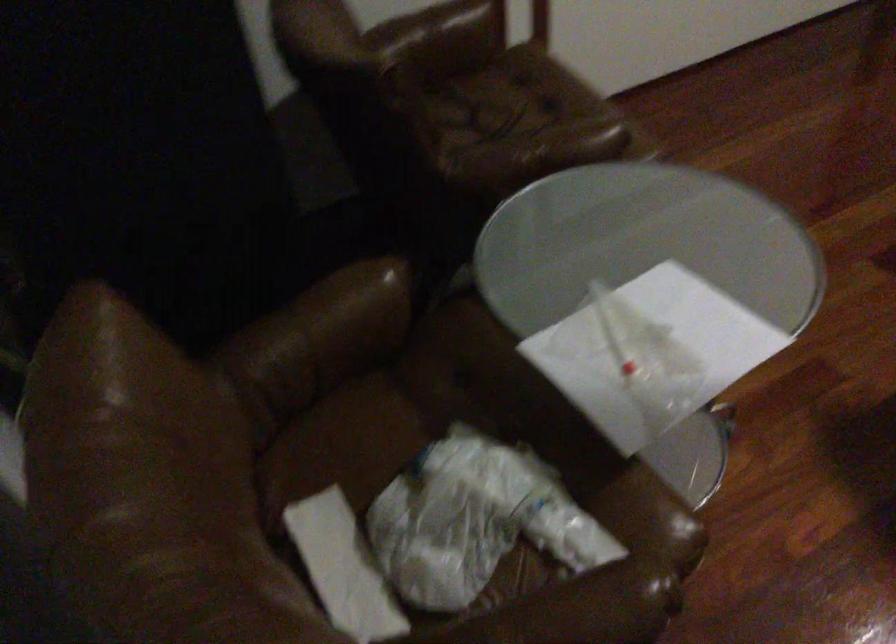
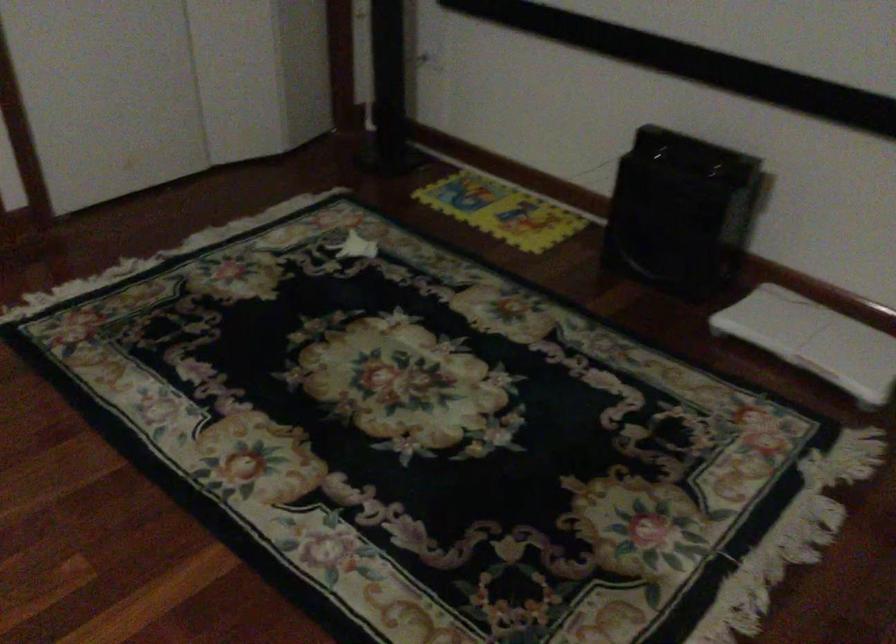
Question: What movement of the cameraman would produce the second image?

Choices:
 (A) Left
 (B) Right
 (C) Forward
 (D) Backward

Answer: (B)